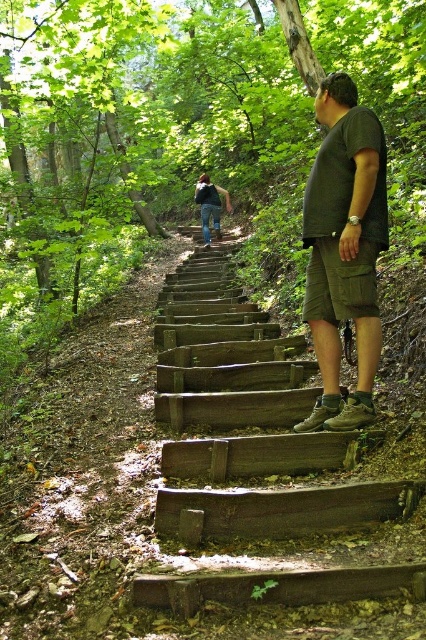
You are standing at the bottom of the weathered wood stairs at center and want to reach the blue jeans at upper center. Which direction should you move?

You should move upward along the weathered wood stairs at center to reach the blue jeans at upper center since the stairs are in front of the jeans, indicating they lead towards them.